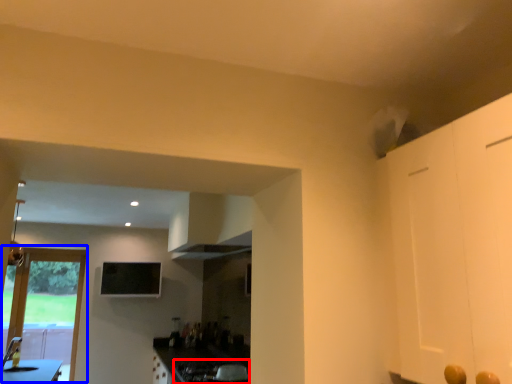
Question: Which point is further to the camera, gas stove (highlighted by a red box) or door (highlighted by a blue box)?

Choices:
 (A) gas stove
 (B) door

Answer: (B)